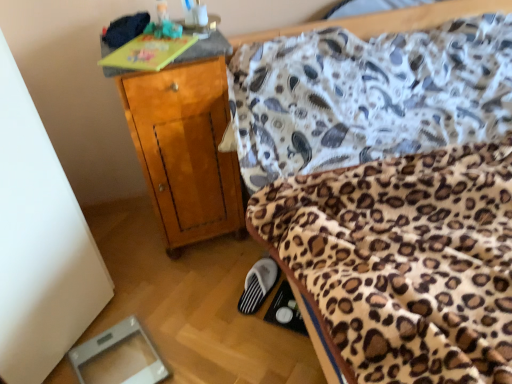
I want to click on vacant space to the left of black suede slipper at lower center, so click(213, 291).